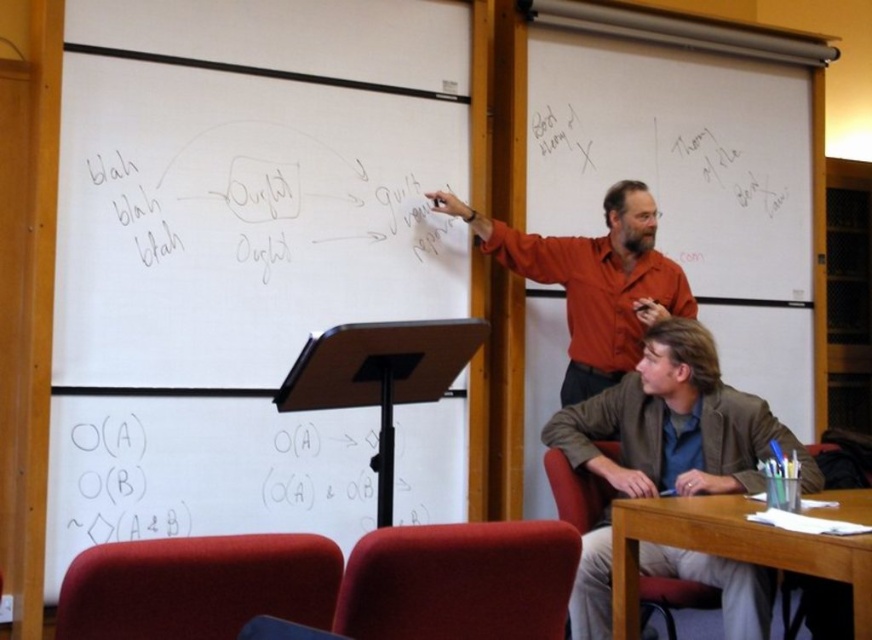
You are a student sitting at the wooden table at lower right and want to ask the man in the matte orange shirt at center a question. Which direction should you look to face him?

The matte orange shirt at center is to the left of the wooden table at lower right, so you should look to your left to face him.

You are a student sitting at your desk in the classroom. You want to point out a specific location on the whiteboard to the teacher. The location is at point [607,433]. If you can reach 2 meters, can you reach that point?

The distance between point [607,433] and the camera is 3.05 meters. Since you can only reach 2 meters, you cannot reach that point.

You are a student entering the classroom and see the brown leather jacket at lower right and the wooden table at lower right. Which object takes up more space in the classroom?

The brown leather jacket at lower right is larger in size than the wooden table at lower right, so it takes up more space in the classroom.